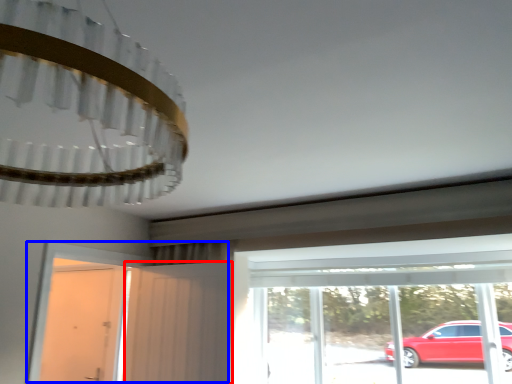
Question: Which object appears closest to the camera in this image, screen door (highlighted by a red box) or door (highlighted by a blue box)?

Choices:
 (A) screen door
 (B) door

Answer: (B)